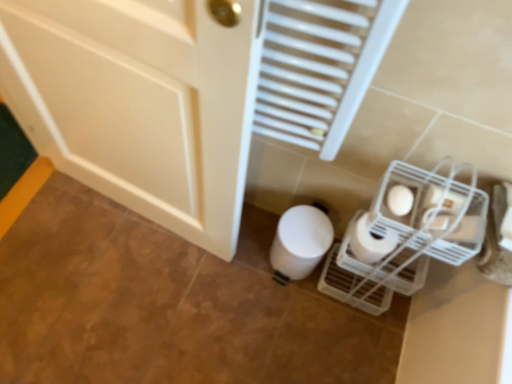
Question: Considering the positions of white plastic radiator at upper center and white matte toilet paper at lower center, the first toilet paper from the back, in the image, is white plastic radiator at upper center wider or thinner than white matte toilet paper at lower center, the first toilet paper from the back,?

Choices:
 (A) wide
 (B) thin

Answer: (B)

Question: In the image, is white plastic radiator at upper center positioned in front of or behind white matte toilet paper at lower center, the first toilet paper from the back?

Choices:
 (A) front
 (B) behind

Answer: (A)

Question: Estimate the real-world distances between objects in this image. Which object is farther from the white matte toilet paper at lower right, the first toilet paper in the front-to-back sequence?

Choices:
 (A) white plastic radiator at upper center
 (B) white matte toilet paper at lower center, the first toilet paper from the back
 (C) white matte toilet paper at lower right, which appears as the second toilet paper when viewed from the back

Answer: (B)

Question: Which is nearer to the white plastic radiator at upper center?

Choices:
 (A) white matte toilet paper at lower right, the first toilet paper in the front-to-back sequence
 (B) white matte toilet paper at lower center, the third toilet paper from the front
 (C) white matte toilet paper at lower right, which is the 2th toilet paper in front-to-back order

Answer: (A)